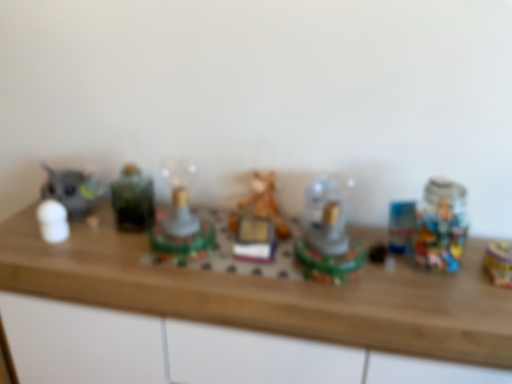
Question: Is translucent plastic toy at center, which is counted as the sixth toy, starting from the left, oriented towards white matte figurine at left, the first toy positioned from the left?

Choices:
 (A) yes
 (B) no

Answer: (B)

Question: Is translucent plastic toy at center, marked as the 2th toy in a right-to-left arrangement, placed right next to white matte figurine at left, the first toy positioned from the left?

Choices:
 (A) no
 (B) yes

Answer: (A)

Question: Is translucent plastic toy at center, marked as the 2th toy in a right-to-left arrangement, oriented away from white matte figurine at left, the seventh toy in the right-to-left sequence?

Choices:
 (A) no
 (B) yes

Answer: (A)

Question: Is translucent plastic toy at center, which is counted as the sixth toy, starting from the left, at the left side of white matte figurine at left, the seventh toy in the right-to-left sequence?

Choices:
 (A) yes
 (B) no

Answer: (B)

Question: From the image's perspective, is translucent plastic toy at center, marked as the 2th toy in a right-to-left arrangement, above white matte figurine at left, the seventh toy in the right-to-left sequence?

Choices:
 (A) no
 (B) yes

Answer: (A)

Question: Considering the relative positions of white matte figurine at left, the first toy positioned from the left, and gold metallic toy at right, which ranks as the 1th toy in right-to-left order, in the image provided, is white matte figurine at left, the first toy positioned from the left, to the left or to the right of gold metallic toy at right, which ranks as the 1th toy in right-to-left order,?

Choices:
 (A) left
 (B) right

Answer: (A)

Question: Is white matte figurine at left, the seventh toy in the right-to-left sequence, taller or shorter than gold metallic toy at right, which ranks as the 1th toy in right-to-left order?

Choices:
 (A) tall
 (B) short

Answer: (A)

Question: In terms of width, does white matte figurine at left, the first toy positioned from the left, look wider or thinner when compared to gold metallic toy at right, the 7th toy positioned from the left?

Choices:
 (A) thin
 (B) wide

Answer: (A)

Question: Based on their sizes in the image, would you say white matte figurine at left, the first toy positioned from the left, is bigger or smaller than gold metallic toy at right, the 7th toy positioned from the left?

Choices:
 (A) big
 (B) small

Answer: (A)

Question: Considering the positions of matte gray cat at left, the second toy in the left-to-right sequence, and shiny green plastic toy at center, marked as the fourth toy in a right-to-left arrangement, in the image, is matte gray cat at left, the second toy in the left-to-right sequence, wider or thinner than shiny green plastic toy at center, marked as the fourth toy in a right-to-left arrangement,?

Choices:
 (A) thin
 (B) wide

Answer: (A)

Question: In terms of height, does matte gray cat at left, the second toy in the left-to-right sequence, look taller or shorter compared to shiny green plastic toy at center, arranged as the fourth toy when viewed from the left?

Choices:
 (A) short
 (B) tall

Answer: (B)

Question: Considering the positions of matte gray cat at left, the sixth toy in the right-to-left sequence, and shiny green plastic toy at center, arranged as the fourth toy when viewed from the left, in the image, is matte gray cat at left, the sixth toy in the right-to-left sequence, bigger or smaller than shiny green plastic toy at center, arranged as the fourth toy when viewed from the left,?

Choices:
 (A) small
 (B) big

Answer: (A)

Question: From the image's perspective, is matte gray cat at left, the sixth toy in the right-to-left sequence, above or below shiny green plastic toy at center, marked as the fourth toy in a right-to-left arrangement?

Choices:
 (A) above
 (B) below

Answer: (A)

Question: From a real-world perspective, is gold metallic toy at right, which ranks as the 1th toy in right-to-left order, positioned above or below matte gray cat at left, the second toy in the left-to-right sequence?

Choices:
 (A) above
 (B) below

Answer: (B)

Question: From the image's perspective, is gold metallic toy at right, which ranks as the 1th toy in right-to-left order, above or below matte gray cat at left, the sixth toy in the right-to-left sequence?

Choices:
 (A) below
 (B) above

Answer: (A)